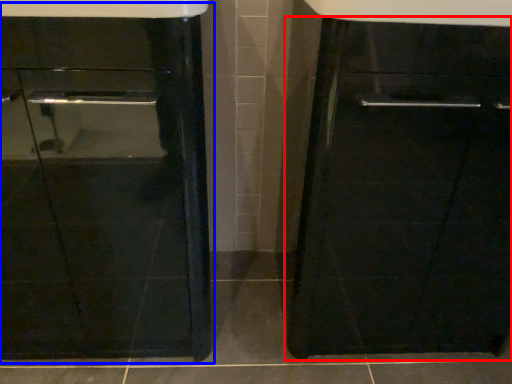
Question: Which object appears farthest to the camera in this image, cabinetry (highlighted by a red box) or sink (highlighted by a blue box)?

Choices:
 (A) cabinetry
 (B) sink

Answer: (A)